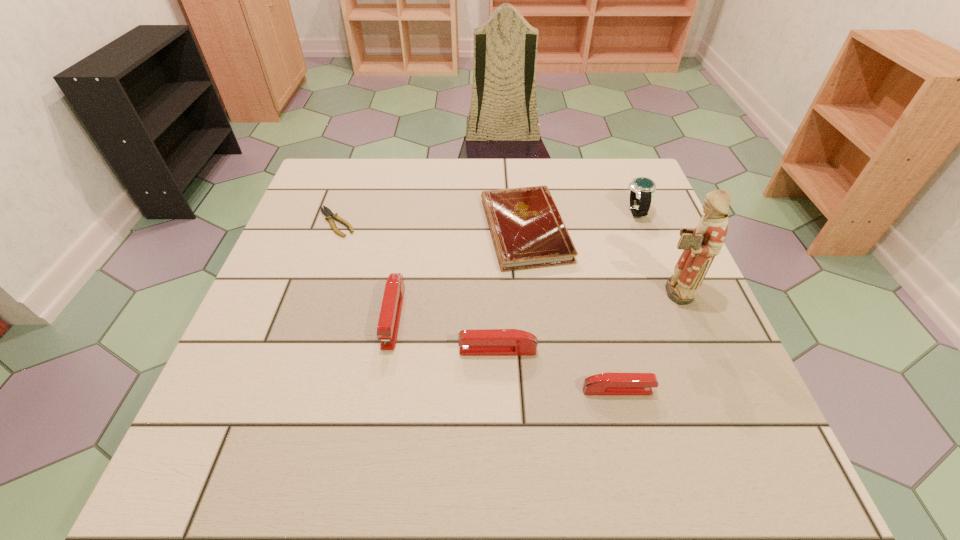
The height and width of the screenshot is (540, 960). I want to click on the second closest stapler relative to the nearest object, so click(388, 325).

Image resolution: width=960 pixels, height=540 pixels. I want to click on stapler object that ranks as the closest to the pliers, so click(388, 325).

The image size is (960, 540). Identify the location of vacant region that satisfies the following two spatial constraints: 1. on the front side of the watch; 2. on the front-facing side of the second stapler from left to right. (690, 350).